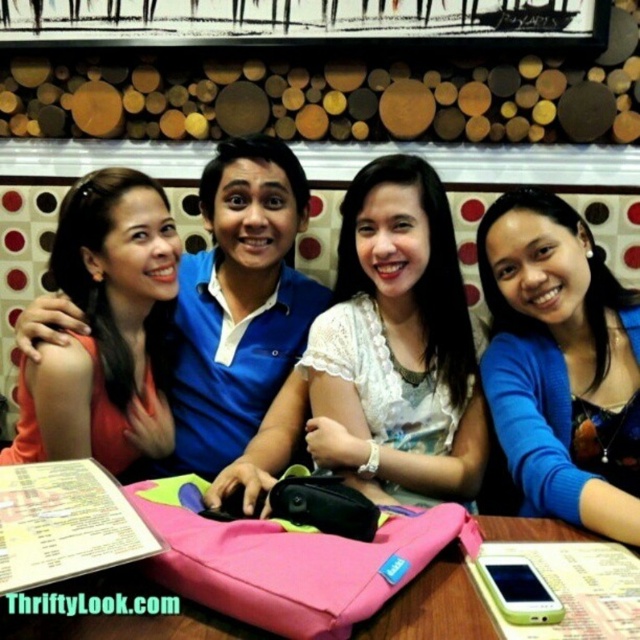
Question: Observing the image, what is the correct spatial positioning of white lace blouse at center in reference to blue matte sweater at center?

Choices:
 (A) right
 (B) left

Answer: (B)

Question: Which of the following is the farthest from the observer?

Choices:
 (A) pink fabric table at center
 (B) matte orange shirt at left
 (C) blue matte sweater at center

Answer: (B)

Question: Can you confirm if matte orange shirt at left is wider than pink fabric table at center?

Choices:
 (A) yes
 (B) no

Answer: (B)

Question: Estimate the real-world distances between objects in this image. Which object is farther from the white lace blouse at center?

Choices:
 (A) blue matte sweater at center
 (B) pink fabric table at center
 (C) matte orange shirt at left

Answer: (C)

Question: Can you confirm if white lace blouse at center is thinner than pink fabric table at center?

Choices:
 (A) no
 (B) yes

Answer: (B)

Question: Considering the real-world distances, which object is closest to the pink fabric table at center?

Choices:
 (A) blue matte sweater at center
 (B) white lace blouse at center

Answer: (B)